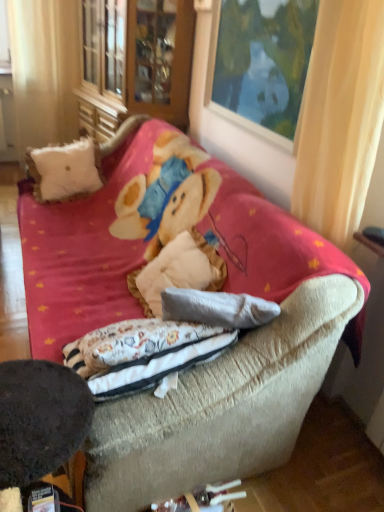
Question: Is dark brown felt round table at lower left facing away from wooden picture frame at upper center?

Choices:
 (A) no
 (B) yes

Answer: (A)

Question: Is dark brown felt round table at lower left aimed at wooden picture frame at upper center?

Choices:
 (A) no
 (B) yes

Answer: (A)

Question: From the image's perspective, does dark brown felt round table at lower left appear higher than wooden picture frame at upper center?

Choices:
 (A) yes
 (B) no

Answer: (B)

Question: From a real-world perspective, is dark brown felt round table at lower left on wooden picture frame at upper center?

Choices:
 (A) no
 (B) yes

Answer: (A)

Question: Is dark brown felt round table at lower left smaller than wooden picture frame at upper center?

Choices:
 (A) yes
 (B) no

Answer: (B)

Question: Is dark brown felt round table at lower left to the left or to the right of velvet beige couch at center in the image?

Choices:
 (A) left
 (B) right

Answer: (A)

Question: From a real-world perspective, relative to velvet beige couch at center, is dark brown felt round table at lower left vertically above or below?

Choices:
 (A) above
 (B) below

Answer: (B)

Question: Considering the positions of dark brown felt round table at lower left and velvet beige couch at center in the image, is dark brown felt round table at lower left wider or thinner than velvet beige couch at center?

Choices:
 (A) thin
 (B) wide

Answer: (A)

Question: From the image's perspective, relative to velvet beige couch at center, is dark brown felt round table at lower left above or below?

Choices:
 (A) below
 (B) above

Answer: (A)

Question: From a real-world perspective, relative to wooden cabinet at upper left, is dark brown felt round table at lower left vertically above or below?

Choices:
 (A) below
 (B) above

Answer: (A)

Question: Considering the positions of point (31, 450) and point (124, 95), is point (31, 450) closer or farther from the camera than point (124, 95)?

Choices:
 (A) closer
 (B) farther

Answer: (A)

Question: Visually, is dark brown felt round table at lower left positioned to the left or to the right of wooden cabinet at upper left?

Choices:
 (A) right
 (B) left

Answer: (A)

Question: From the image's perspective, is dark brown felt round table at lower left positioned above or below wooden cabinet at upper left?

Choices:
 (A) below
 (B) above

Answer: (A)

Question: From a real-world perspective, is white fabric curtain at left, the first curtain positioned from the left, positioned above or below dark brown felt round table at lower left?

Choices:
 (A) above
 (B) below

Answer: (A)

Question: In terms of height, does white fabric curtain at left, acting as the second curtain starting from the right, look taller or shorter compared to dark brown felt round table at lower left?

Choices:
 (A) tall
 (B) short

Answer: (A)